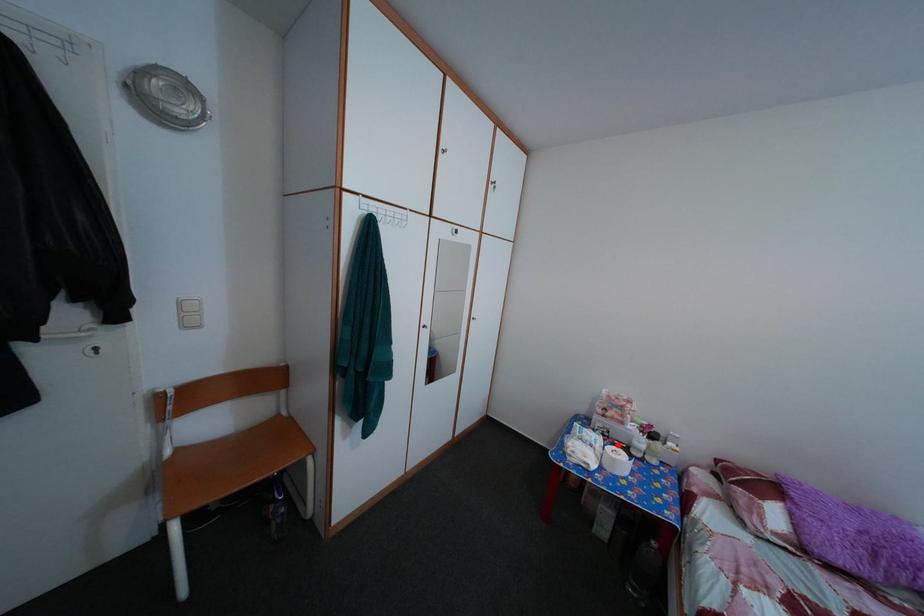
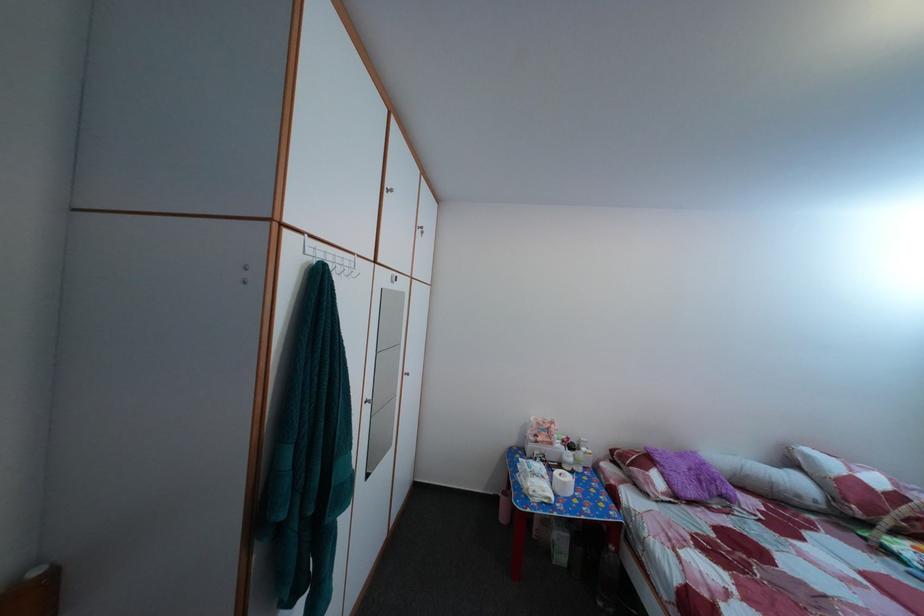
Question: I am providing you with two images of the same scene from different viewpoints. Image1 has a red point marked. In image2, the corresponding 3D location appears at what relative position? Reply with the corresponding letter.

Choices:
 (A) Closer
 (B) Farther

Answer: (B)